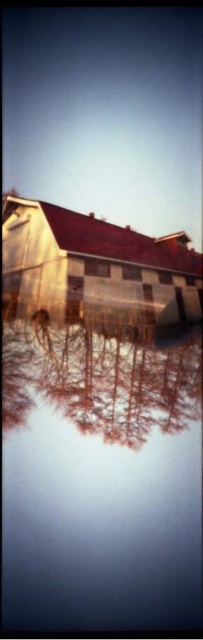
You are standing at the point closer to the building in the image. Which point are you at, point (142, 470) or point (105, 246)?

Point (142, 470) is in front of point (105, 246), so if you are standing closer to the building, you are at point (142, 470).

You are an architect designing a new building that needs to be placed between the transparent glass water at center and the smooth glass trees at center. Which object should you place the building closer to if you want it to be closer to the narrower area?

You should place the building closer to the transparent glass water at center because it has a lesser width compared to the smooth glass trees at center, making it the narrower area.

You are standing in front of the building and want to take a photo that includes both the transparent glass water at center and the wooden barn at center. Which object will appear taller in the photo?

The transparent glass water at center will appear taller in the photo because it has a greater height compared to the wooden barn at center.